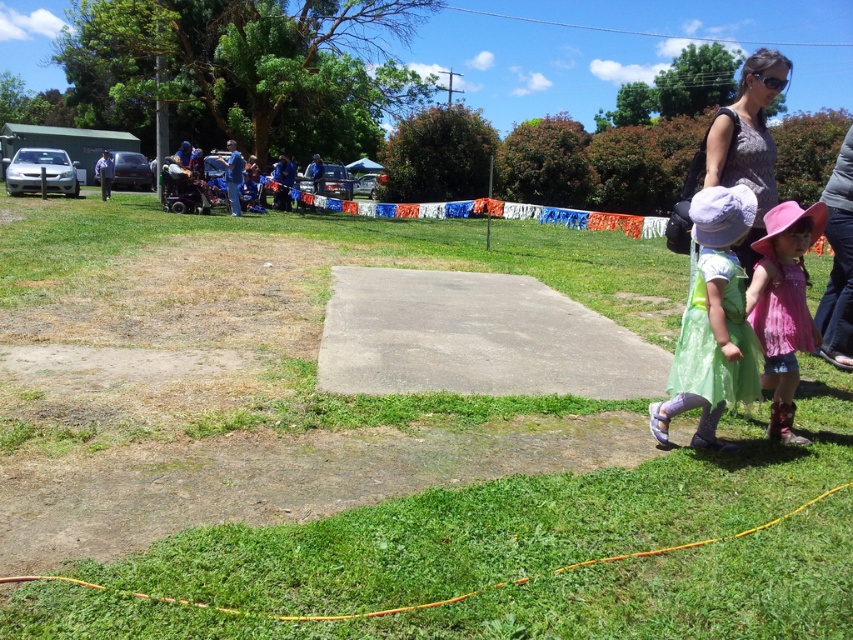
Question: Which point is closer to the camera?

Choices:
 (A) (407, 573)
 (B) (798, 321)
 (C) (695, 317)
 (D) (717, 154)

Answer: (A)

Question: Can you confirm if pastel green dress at right is positioned to the right of pink fabric dress at right?

Choices:
 (A) no
 (B) yes

Answer: (A)

Question: Does pastel green dress at right have a lesser width compared to matte gray shirt at upper right?

Choices:
 (A) yes
 (B) no

Answer: (A)

Question: Considering the real-world distances, which object is farthest from the green grass at center?

Choices:
 (A) matte gray shirt at upper right
 (B) pink fabric dress at lower right
 (C) pastel green dress at right
 (D) pink fabric dress at right

Answer: (D)

Question: Does green grass at center have a smaller size compared to matte gray shirt at upper right?

Choices:
 (A) no
 (B) yes

Answer: (B)

Question: Which of the following is the closest to the observer?

Choices:
 (A) matte gray shirt at upper right
 (B) pink fabric dress at lower right
 (C) pink fabric dress at right

Answer: (B)